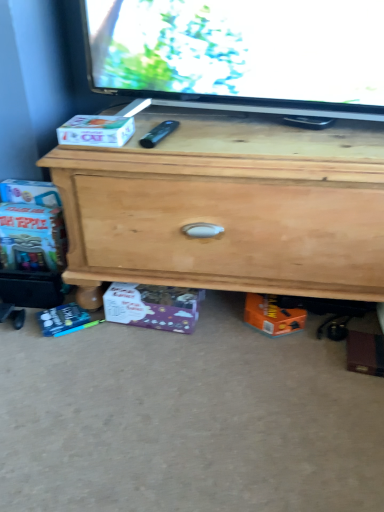
Question: Is natural wood chest of drawers at center thinner than white cardboard box at left, which is counted as the second box, starting from the back?

Choices:
 (A) no
 (B) yes

Answer: (A)

Question: Is natural wood chest of drawers at center taller than white cardboard box at left, which is counted as the second box, starting from the back?

Choices:
 (A) no
 (B) yes

Answer: (B)

Question: Is natural wood chest of drawers at center to the left of white cardboard box at left, the 1th box in the top-to-bottom sequence, from the viewer's perspective?

Choices:
 (A) yes
 (B) no

Answer: (B)

Question: From the image's perspective, does natural wood chest of drawers at center appear lower than white cardboard box at left, positioned as the 2th box in bottom-to-top order?

Choices:
 (A) no
 (B) yes

Answer: (B)

Question: Would you say natural wood chest of drawers at center is outside white cardboard box at left, which is the 1th box from front to back?

Choices:
 (A) no
 (B) yes

Answer: (B)

Question: Is natural wood chest of drawers at center further to the viewer compared to white cardboard box at left, positioned as the 2th box in bottom-to-top order?

Choices:
 (A) yes
 (B) no

Answer: (B)

Question: Could you tell me if purple cardboard box at lower center, positioned as the 2th box in top-to-bottom order, is turned towards white cardboard box at left, positioned as the 2th box in bottom-to-top order?

Choices:
 (A) no
 (B) yes

Answer: (A)

Question: From a real-world perspective, is purple cardboard box at lower center, acting as the first box starting from the back, positioned over white cardboard box at left, positioned as the 2th box in bottom-to-top order, based on gravity?

Choices:
 (A) yes
 (B) no

Answer: (B)

Question: From the image's perspective, is purple cardboard box at lower center, positioned as the 1th box in bottom-to-top order, located beneath white cardboard box at left, which is counted as the second box, starting from the back?

Choices:
 (A) no
 (B) yes

Answer: (B)

Question: Considering the relative sizes of purple cardboard box at lower center, positioned as the 2th box in top-to-bottom order, and white cardboard box at left, which is the 1th box from front to back, in the image provided, is purple cardboard box at lower center, positioned as the 2th box in top-to-bottom order, bigger than white cardboard box at left, which is the 1th box from front to back,?

Choices:
 (A) yes
 (B) no

Answer: (A)

Question: Considering the relative sizes of purple cardboard box at lower center, acting as the first box starting from the back, and white cardboard box at left, which is counted as the second box, starting from the back, in the image provided, is purple cardboard box at lower center, acting as the first box starting from the back, taller than white cardboard box at left, which is counted as the second box, starting from the back,?

Choices:
 (A) no
 (B) yes

Answer: (B)

Question: Does purple cardboard box at lower center, positioned as the 2th box in top-to-bottom order, come behind white cardboard box at left, which is the 1th box from front to back?

Choices:
 (A) yes
 (B) no

Answer: (A)

Question: Considering the relative sizes of purple cardboard box at lower center, acting as the first box starting from the back, and natural wood chest of drawers at center in the image provided, is purple cardboard box at lower center, acting as the first box starting from the back, wider than natural wood chest of drawers at center?

Choices:
 (A) yes
 (B) no

Answer: (B)